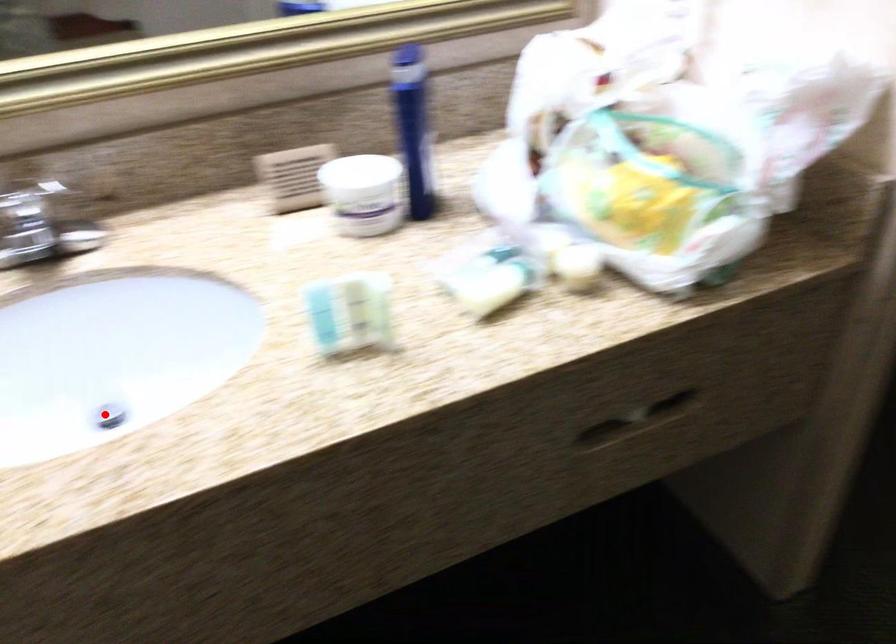
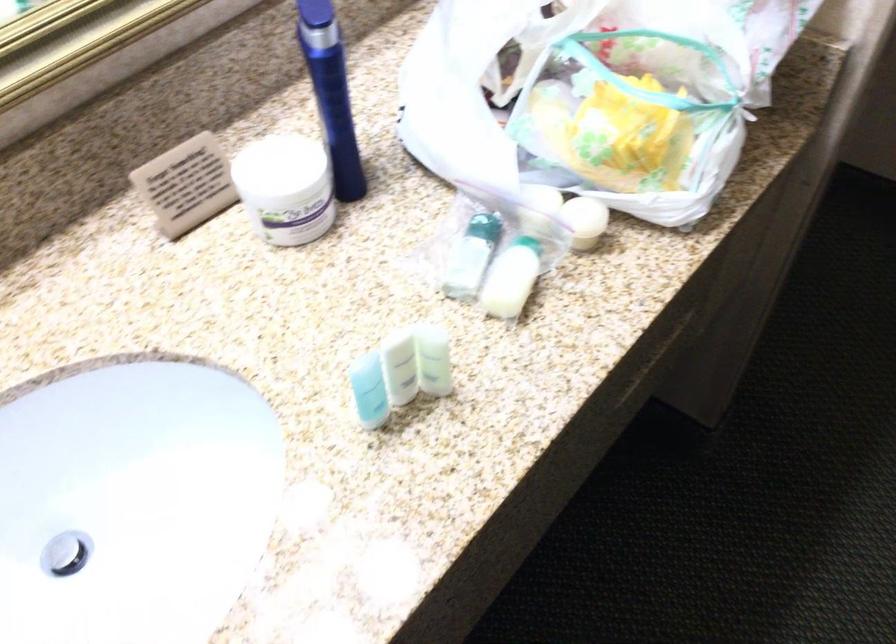
In the second image, find the point that corresponds to the highlighted location in the first image.

(65, 554)